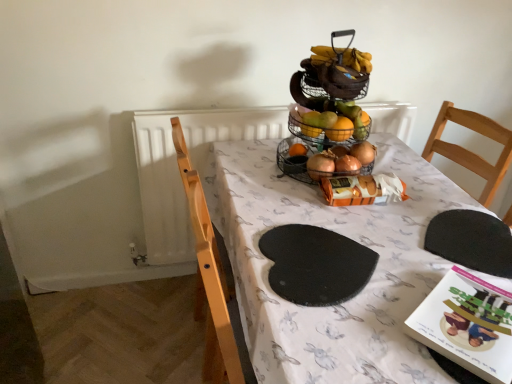
Locate an element on the screen. This screenshot has width=512, height=384. vacant space positioned to the left of black rubber placemat at lower right, which is counted as the first mat, starting from the right is located at coordinates [x=388, y=241].